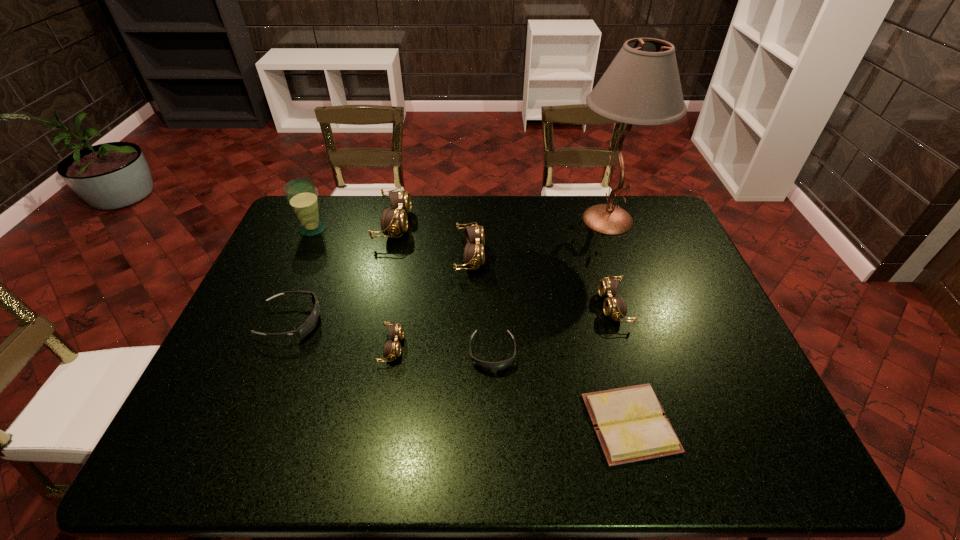
This screenshot has width=960, height=540. Identify the location of vacant area at the far left corner. (290, 224).

In order to click on vacant space in between the nearest object and the glass in this screenshot , I will do `click(471, 326)`.

At what (x,y) coordinates should I click in order to perform the action: click on blank region between the tallest goggles and the table lamp. Please return your answer as a coordinate pair (x, y). The height and width of the screenshot is (540, 960). Looking at the image, I should click on (501, 222).

You are a GUI agent. You are given a task and a screenshot of the screen. Output one action in this format:
    pyautogui.click(x=<x>, y=<y>)
    Task: Click on the empty location between the second tallest goggles and the bigger black goggles
    The image size is (960, 540).
    Given the screenshot: What is the action you would take?
    pyautogui.click(x=380, y=288)

Find the location of a particular element. Image resolution: width=960 pixels, height=540 pixels. vacant space that's between the third smallest brown goggles and the right black goggles is located at coordinates (481, 304).

Where is `unoccupied position between the rightmost brown goggles and the leftmost goggles`? Image resolution: width=960 pixels, height=540 pixels. unoccupied position between the rightmost brown goggles and the leftmost goggles is located at coordinates (452, 313).

Image resolution: width=960 pixels, height=540 pixels. I want to click on vacant region between the second smallest brown goggles and the table lamp, so click(x=611, y=263).

The height and width of the screenshot is (540, 960). I want to click on vacant space that is in between the shortest object and the table lamp, so click(619, 321).

Find the location of `free spot between the smallest brown goggles and the nearest object`. free spot between the smallest brown goggles and the nearest object is located at coordinates (511, 385).

You are a GUI agent. You are given a task and a screenshot of the screen. Output one action in this format:
    pyautogui.click(x=<x>, y=<y>)
    Task: Click on the vacant region between the third tallest goggles and the left black goggles
    The image size is (960, 540).
    Given the screenshot: What is the action you would take?
    pyautogui.click(x=452, y=313)